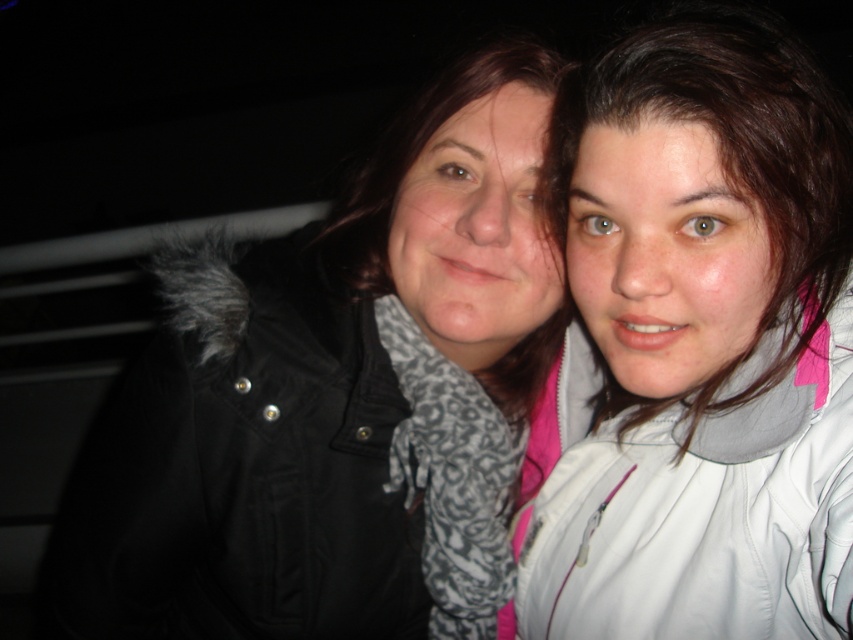
You are a photographer trying to adjust the lighting for a night portrait. You notice the black matte jacket at center and the white matte jacket at right in the frame. Which jacket should you focus your flash on to ensure both are properly illuminated?

The black matte jacket at center is located below the white matte jacket at right. Since the black jacket may absorb more light, focusing the flash on it could help balance the exposure between both jackets.

You are a photographer trying to adjust the focus of your camera. You have two points to focus on in the image. The first is point (351, 387) and the second is point (590, 202). Which point should you focus on if you want the subject closer to you to be in sharp focus?

You should focus on point (351, 387) because it is closer to the viewer than point (590, 202), ensuring the closer subject is in sharp focus.